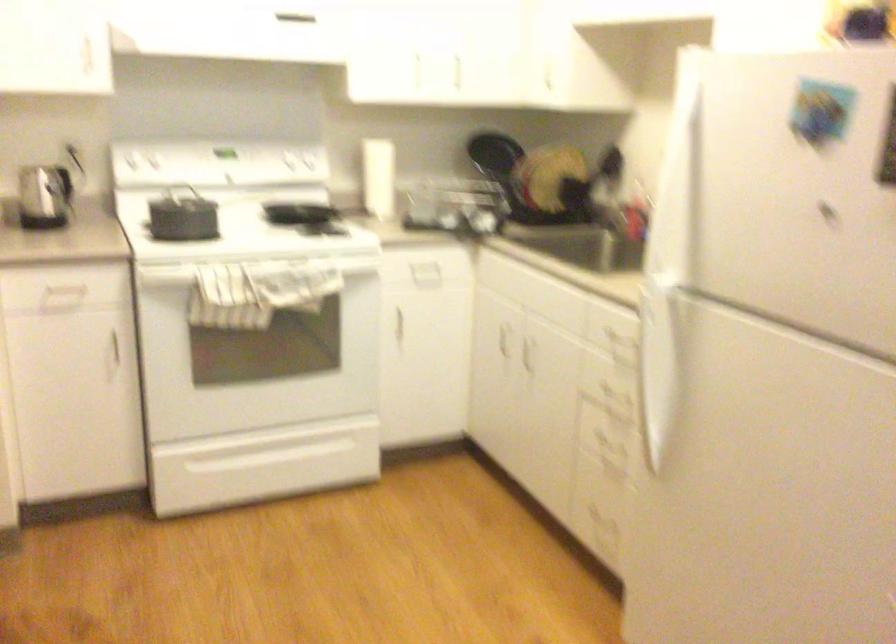
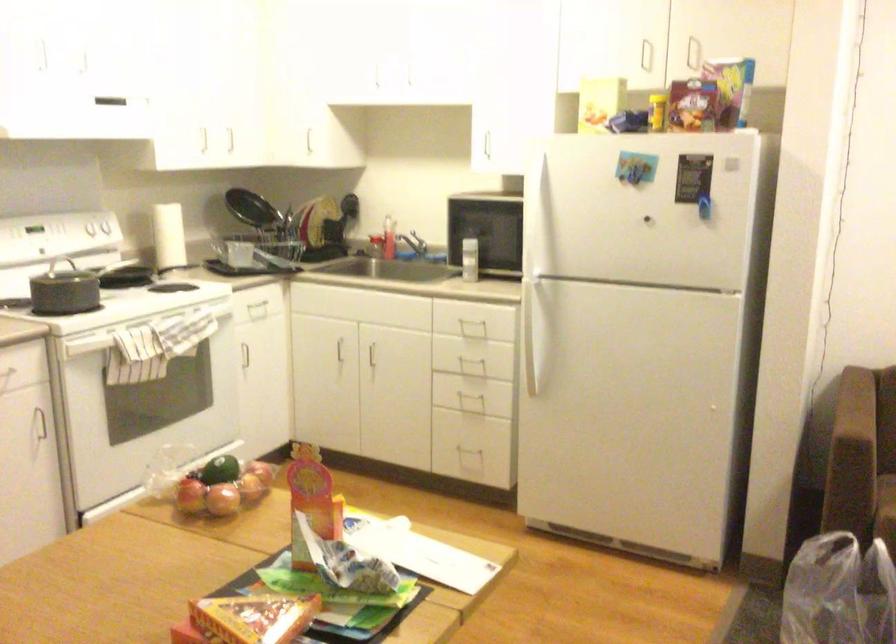
In the second image, find the point that corresponds to point 261,332 in the first image.

(174, 382)